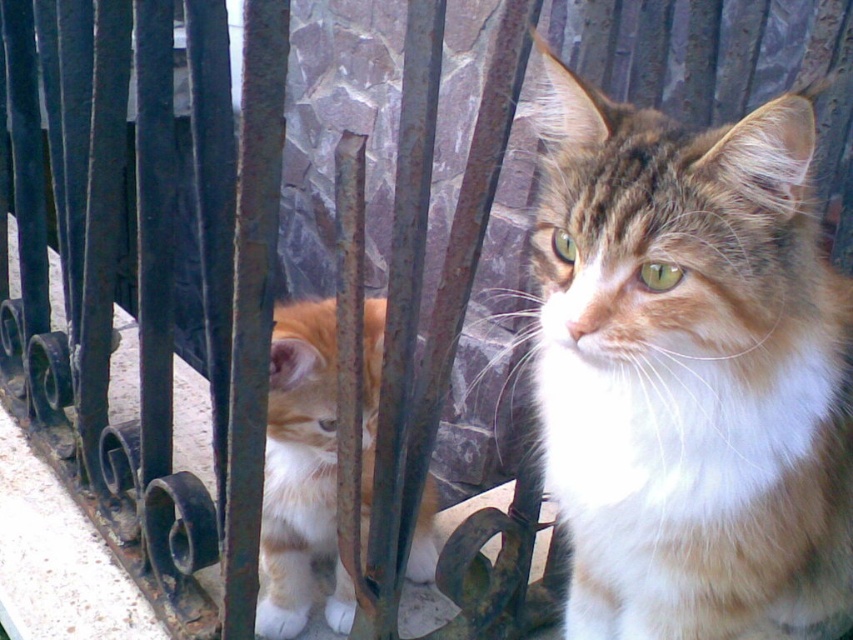
Question: Is the position of fluffy orange-white cat at center less distant than that of orange tabby fur at left?

Choices:
 (A) yes
 (B) no

Answer: (A)

Question: Is fluffy orange-white cat at center positioned behind orange tabby fur at left?

Choices:
 (A) no
 (B) yes

Answer: (A)

Question: Which object is farther from the camera taking this photo?

Choices:
 (A) fluffy orange-white cat at center
 (B) orange tabby fur at left

Answer: (B)

Question: Does fluffy orange-white cat at center appear over orange tabby fur at left?

Choices:
 (A) yes
 (B) no

Answer: (A)